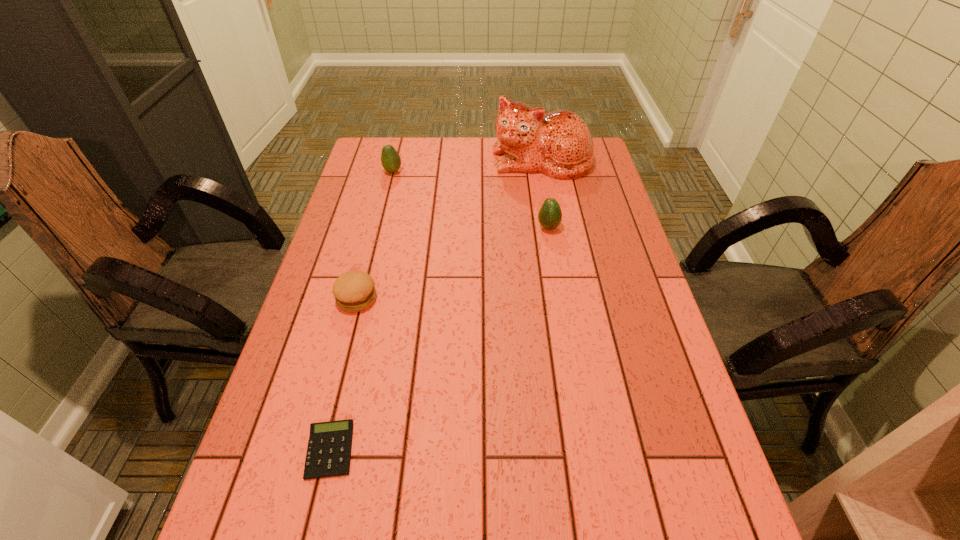
The height and width of the screenshot is (540, 960). I want to click on vacant area that lies between the nearest object and the tallest object, so click(436, 306).

This screenshot has height=540, width=960. Find the location of `vacant point located between the calculator and the right avocado`. vacant point located between the calculator and the right avocado is located at coordinates (440, 339).

Identify the location of vacant region between the tallest object and the left avocado. The height and width of the screenshot is (540, 960). (468, 166).

Select which object appears as the third closest to the tallest object. Please provide its 2D coordinates. Your answer should be formatted as a tuple, i.e. [(x, y)], where the tuple contains the x and y coordinates of a point satisfying the conditions above.

[(354, 291)]

This screenshot has height=540, width=960. What are the coordinates of `the second closest object relative to the hamburger` in the screenshot? It's located at (550, 215).

In order to click on blank space that satisfies the following two spatial constraints: 1. on the front side of the left avocado; 2. on the right side of the nearest object in this screenshot , I will do `click(324, 450)`.